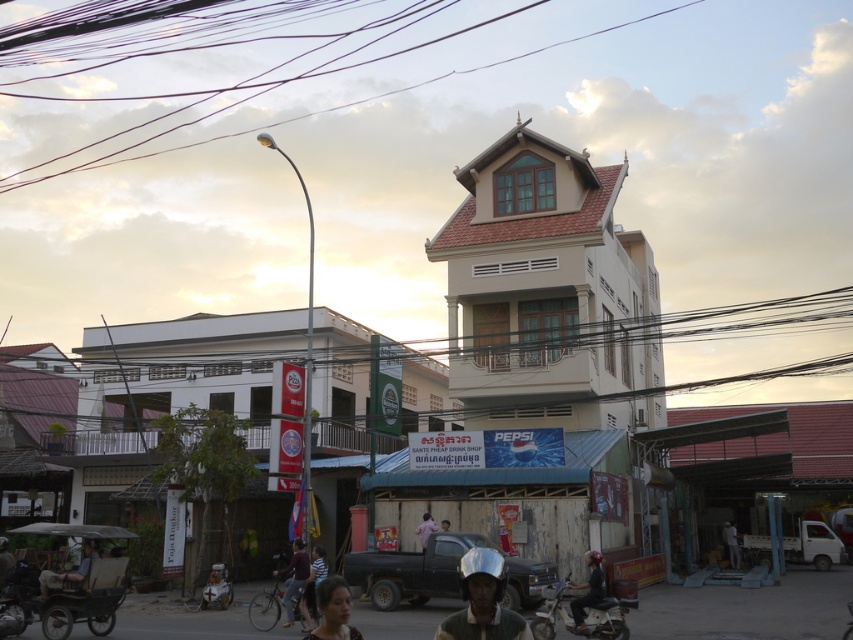
Based on the photo, you are standing at the Pepsi advertisement and want to reach the striped shirt at lower center. The khaki fabric pants at lower left is blocking your path. Can you walk around them without getting closer than 1 meter?

The khaki fabric pants at lower left is 5.16 meters away from the striped shirt at lower center. Since you need to stay at least 1 meter away from the khaki fabric pants at lower left, you can walk around them as long as you maintain that distance.